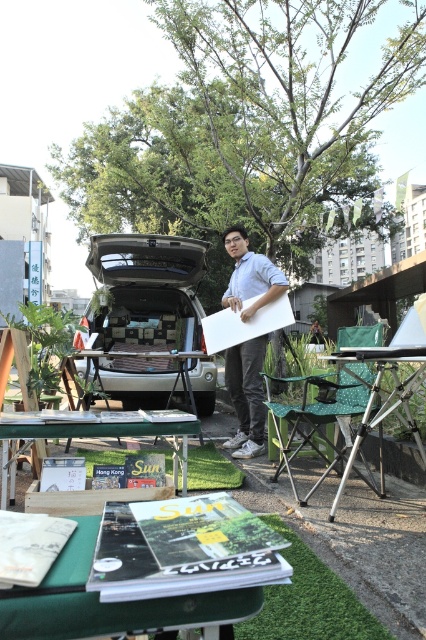
Question: Which point is farther from the camera taking this photo?

Choices:
 (A) (83, 424)
 (B) (261, 340)

Answer: (B)

Question: Is green fabric table at lower center below matte white board at center?

Choices:
 (A) no
 (B) yes

Answer: (B)

Question: From the image, what is the correct spatial relationship of satin silver car at center in relation to green wooden table at lower left?

Choices:
 (A) right
 (B) left

Answer: (B)

Question: Among these points, which one is nearest to the camera?

Choices:
 (A) (183, 260)
 (B) (279, 464)

Answer: (B)

Question: Estimate the real-world distances between objects in this image. Which object is farther from the matte white board at center?

Choices:
 (A) green wooden table at lower left
 (B) metallic tripod table at lower right

Answer: (A)

Question: Does matte white board at center have a greater width compared to green wooden table at lower left?

Choices:
 (A) no
 (B) yes

Answer: (A)